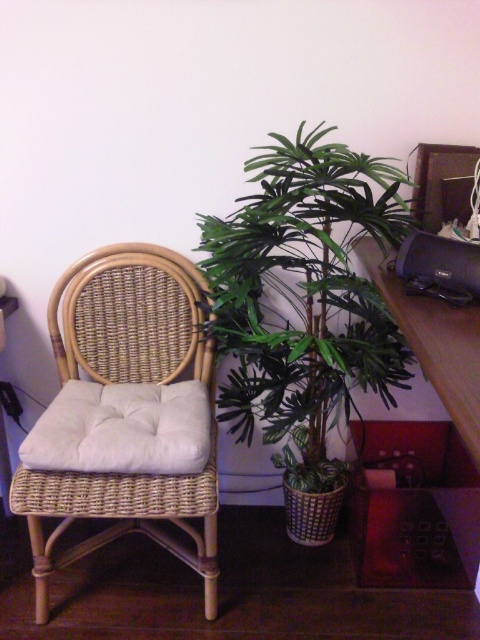
Question: Does green leafy plant at center lie in front of woven rattan swivel chair at left?

Choices:
 (A) no
 (B) yes

Answer: (B)

Question: Is green leafy plant at center smaller than woven rattan swivel chair at left?

Choices:
 (A) no
 (B) yes

Answer: (A)

Question: Where is green leafy plant at center located in relation to woven rattan swivel chair at left in the image?

Choices:
 (A) right
 (B) left

Answer: (A)

Question: Which point is farther to the camera?

Choices:
 (A) green leafy plant at center
 (B) woven rattan swivel chair at left

Answer: (B)